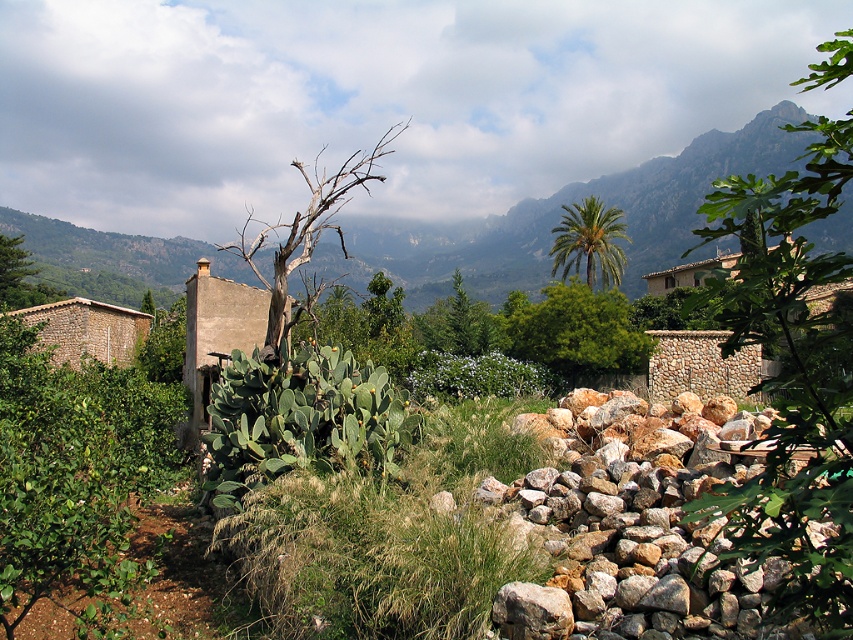
Question: Which object is farther from the camera taking this photo?

Choices:
 (A) dead wood tree at center
 (B) brown stone hut at left
 (C) green leafy tree at center

Answer: (C)

Question: Which object appears closest to the camera in this image?

Choices:
 (A) green leafy tree at center
 (B) green leafy palm at upper center

Answer: (A)

Question: Which object is closer to the camera taking this photo?

Choices:
 (A) green leafy palm at upper center
 (B) green leafy tree at right
 (C) beige stone hut at center

Answer: (B)

Question: Does green leafy tree at right lie behind green leafy tree at center?

Choices:
 (A) yes
 (B) no

Answer: (B)

Question: Is green leafy tree at right thinner than brown stone hut at left?

Choices:
 (A) no
 (B) yes

Answer: (A)

Question: Does green leafy tree at right have a greater width compared to green leafy palm at upper center?

Choices:
 (A) no
 (B) yes

Answer: (B)